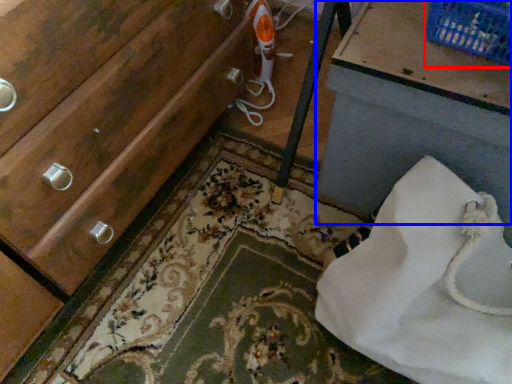
Question: Which of the following is the farthest to the observer, basket (highlighted by a red box) or vanity (highlighted by a blue box)?

Choices:
 (A) basket
 (B) vanity

Answer: (A)